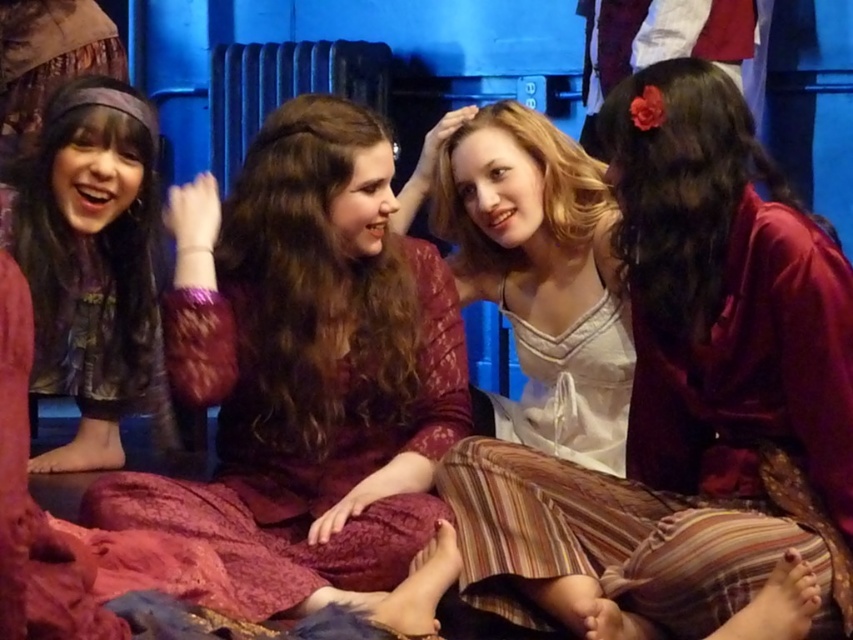
You are a photographer setting up a shoot in this scene. You need to position a backdrop that can accommodate both the matte burgundy dress at center and the white satin dress at center. Based on their sizes, which dress requires more horizontal space and why?

The matte burgundy dress at center requires more horizontal space because its width is larger than the white satin dress at center.

You are a photographer setting up for a photoshoot in this scene. You need to place a 3ft wide backdrop stand between the white satin dress at center and the metallic radiator at center. Can the stand fit there based on their sizes?

The white satin dress at center has a smaller size compared to metallic radiator at center, so the 3ft wide backdrop stand may not fit between them if the space between is narrower than 3ft. However, the description only provides size comparison between the two objects, not the exact distance between them. Without knowing the actual distance, it is impossible to determine if the stand will fit.